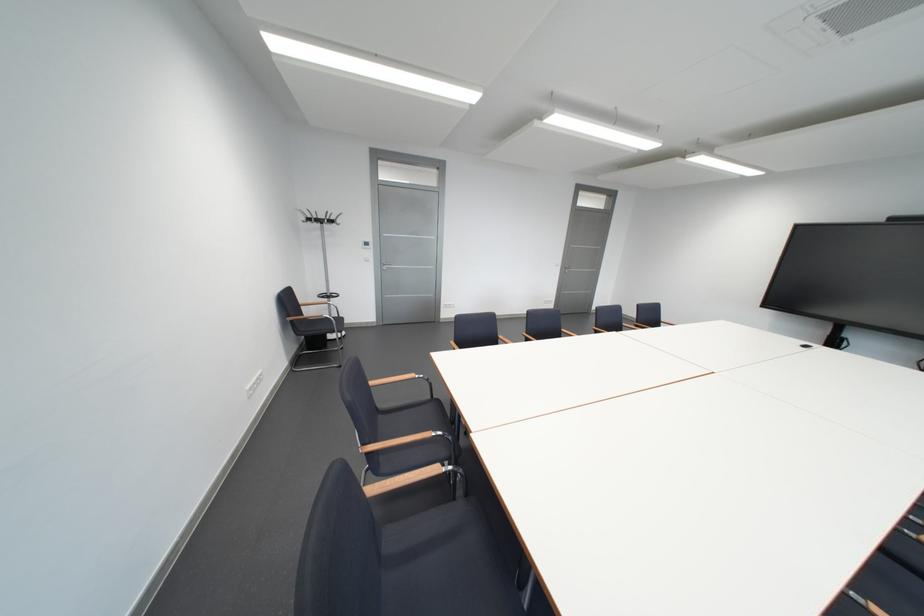
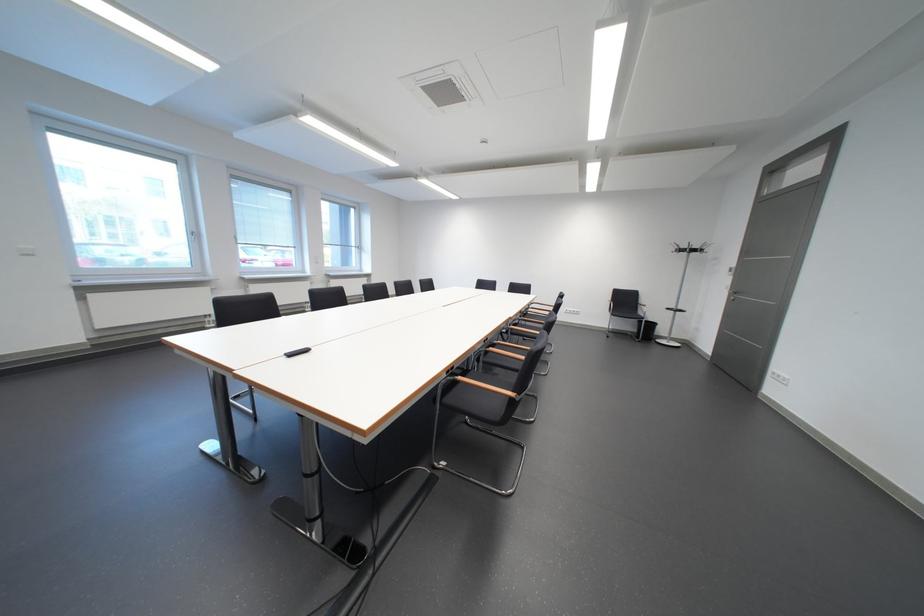
Where in the second image is the point corresponding to (x=334, y=217) from the first image?

(698, 248)